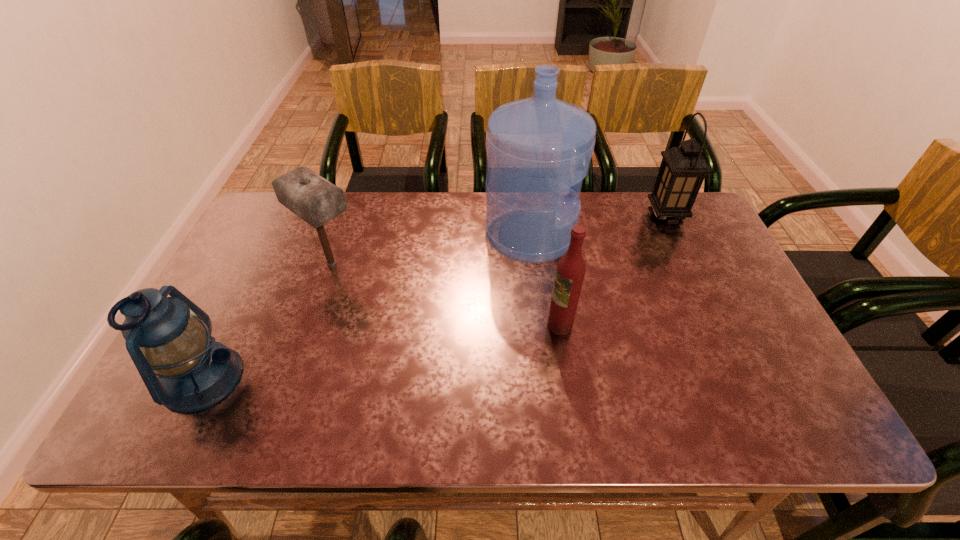
Find the location of a particular element. vacant area that lies between the nearer lantern and the second object from left to right is located at coordinates (267, 321).

Find the location of `free space between the farther lantern and the second nearest object`. free space between the farther lantern and the second nearest object is located at coordinates (612, 271).

Locate an element on the screen. vacant space that's between the liquor and the tallest object is located at coordinates (545, 280).

The width and height of the screenshot is (960, 540). What are the coordinates of `free space between the water jug and the second object from left to right` in the screenshot? It's located at (431, 249).

You are a GUI agent. You are given a task and a screenshot of the screen. Output one action in this format:
    pyautogui.click(x=<x>, y=<y>)
    Task: Click on the object that stands as the fourth closest to the mallet
    This screenshot has height=540, width=960.
    Given the screenshot: What is the action you would take?
    pyautogui.click(x=683, y=169)

Locate which object ranks in proximity to the mallet. Please provide its 2D coordinates. Your answer should be formatted as a tuple, i.e. [(x, y)], where the tuple contains the x and y coordinates of a point satisfying the conditions above.

[(195, 372)]

Where is `free space in the image that satisfies the following two spatial constraints: 1. on the front side of the taller lantern; 2. on the label of the second nearest object`? free space in the image that satisfies the following two spatial constraints: 1. on the front side of the taller lantern; 2. on the label of the second nearest object is located at coordinates (717, 325).